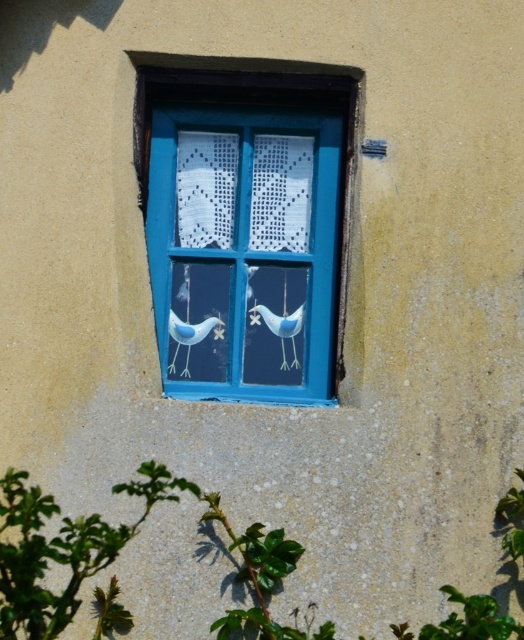
Question: Does blue painted wood at center have a lesser width compared to blue matte bird at center?

Choices:
 (A) no
 (B) yes

Answer: (A)

Question: Does blue painted wood at center have a greater width compared to white matte bird at center?

Choices:
 (A) yes
 (B) no

Answer: (A)

Question: Can you confirm if blue painted wood at center is thinner than white matte bird at center?

Choices:
 (A) yes
 (B) no

Answer: (B)

Question: Which point is farther to the camera?

Choices:
 (A) (180, 321)
 (B) (333, 310)
 (C) (298, 316)

Answer: (C)

Question: Which object is positioned closest to the white matte bird at center?

Choices:
 (A) blue painted wood at center
 (B) blue matte bird at center

Answer: (B)

Question: Which of the following is the closest to the observer?

Choices:
 (A) (219, 317)
 (B) (242, 273)

Answer: (A)